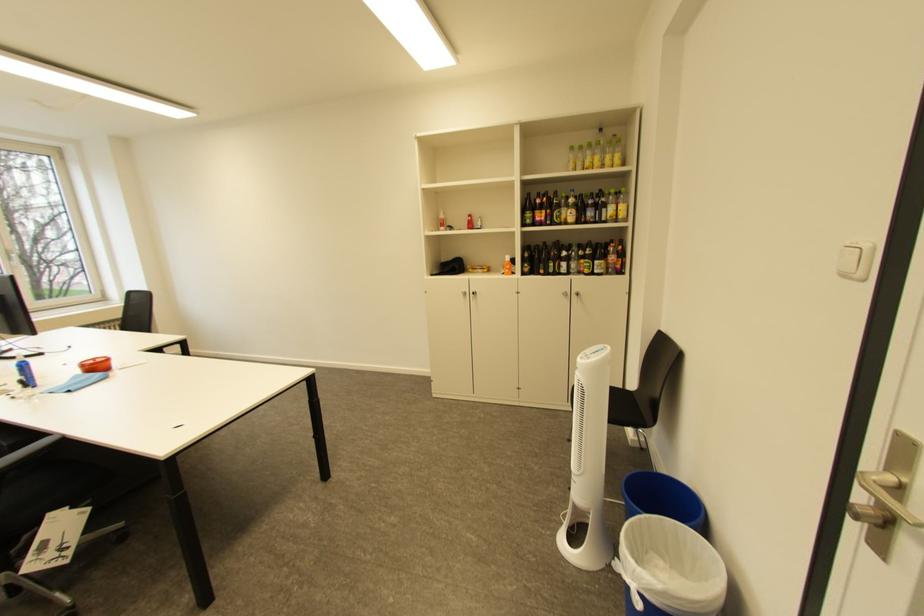
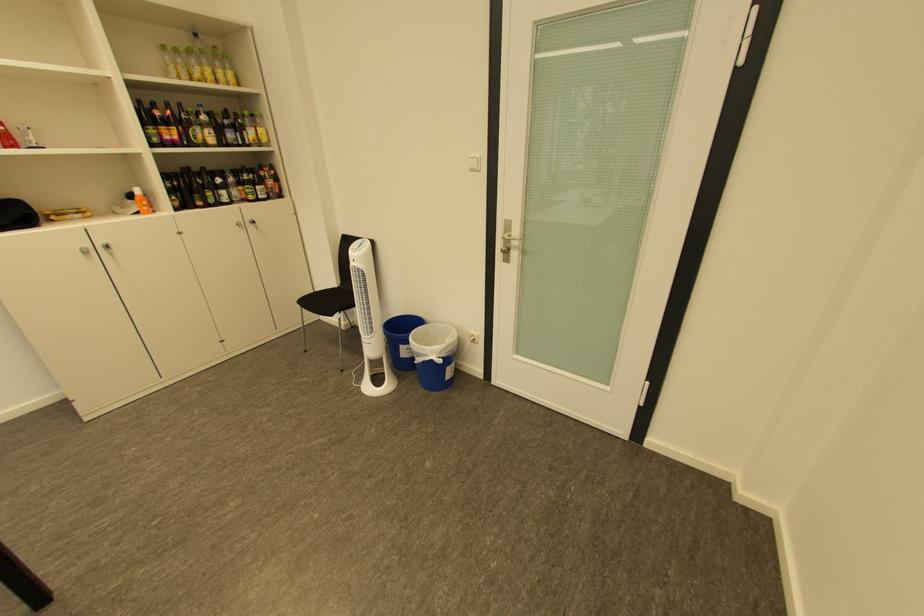
In the second image, find the point that corresponds to pixel 580 161 in the first image.

(180, 66)